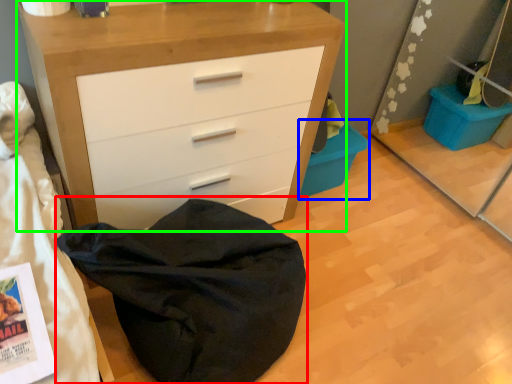
Question: Which object is positioned closest to bean bag chair (highlighted by a red box)? Select from cabinetry (highlighted by a blue box) and chest of drawers (highlighted by a green box).

Choices:
 (A) cabinetry
 (B) chest of drawers

Answer: (B)